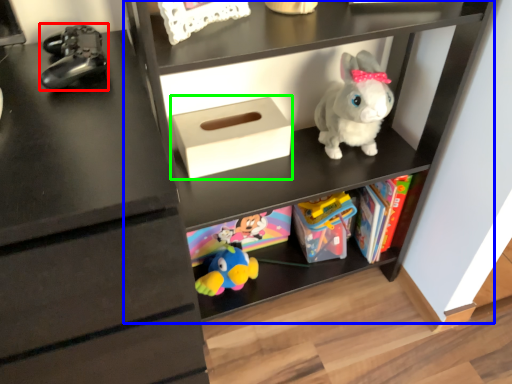
Question: Which object is the closest to the toy (highlighted by a red box)? Choose among these: shelf (highlighted by a blue box) or shoe box (highlighted by a green box).

Choices:
 (A) shelf
 (B) shoe box

Answer: (B)